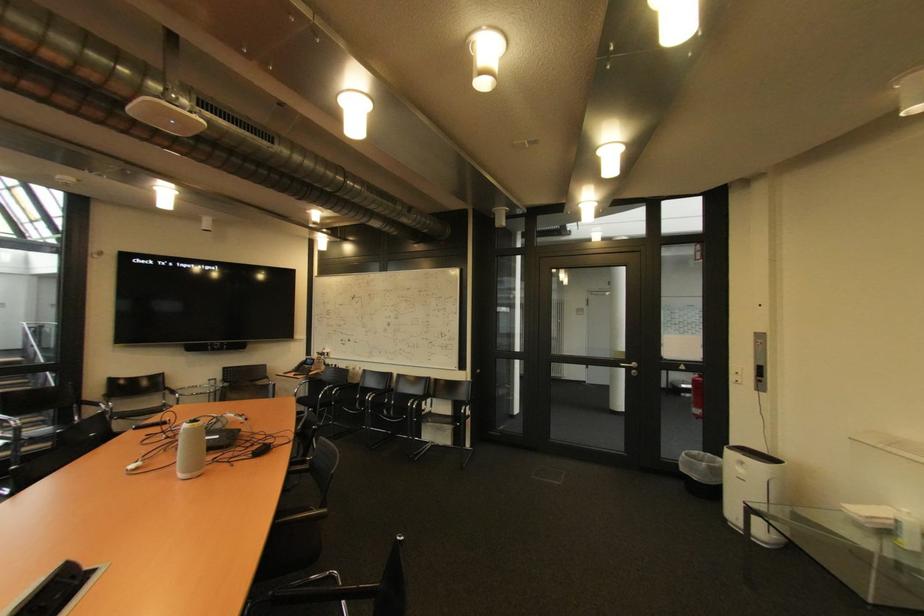
Locate an element on the screen. elevator call button is located at coordinates (760, 361).